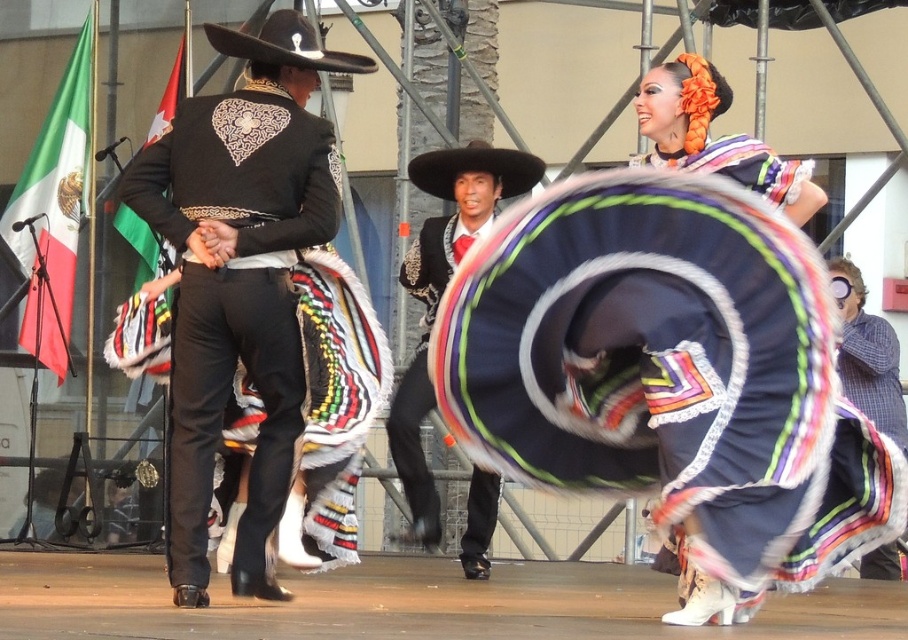
Question: Does velvet dark blue sombrero at center lie behind black satin vest at center?

Choices:
 (A) yes
 (B) no

Answer: (B)

Question: Among these points, which one is farthest from the camera?

Choices:
 (A) (368, 58)
 (B) (30, 291)
 (C) (894, 554)

Answer: (B)

Question: Can you confirm if velvet dark blue sombrero at center is wider than plaid fabric shirt at right?

Choices:
 (A) yes
 (B) no

Answer: (A)

Question: Which object is closer to the camera taking this photo?

Choices:
 (A) green-white-red fabric flag at left
 (B) shiny black sombrero at upper center

Answer: (B)

Question: Is black satin vest at center bigger than matte black sombrero at center?

Choices:
 (A) yes
 (B) no

Answer: (B)

Question: Which point is farther to the camera?

Choices:
 (A) green-white-red fabric flag at left
 (B) velvet dark blue sombrero at center
 (C) plaid fabric shirt at right
 (D) matte black sombrero at center

Answer: (A)